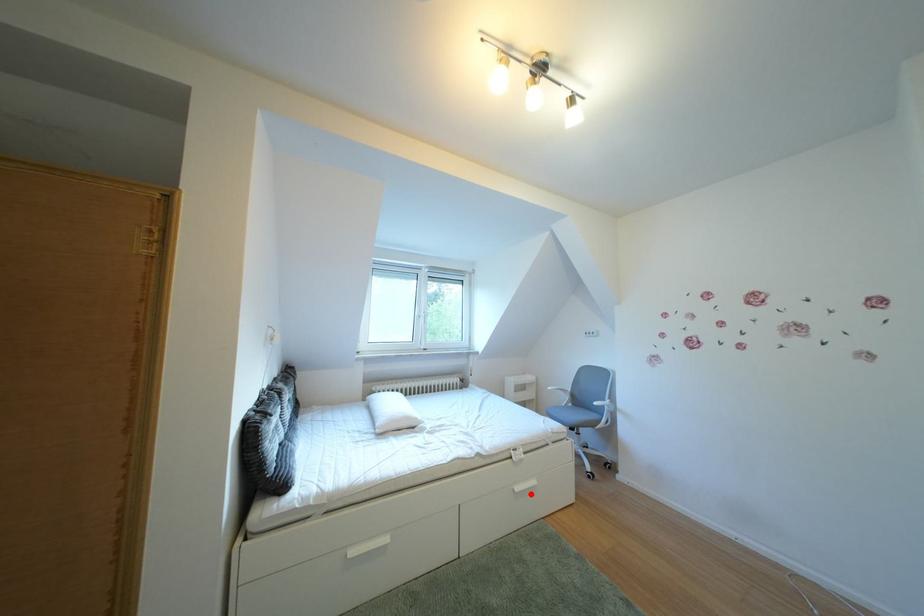
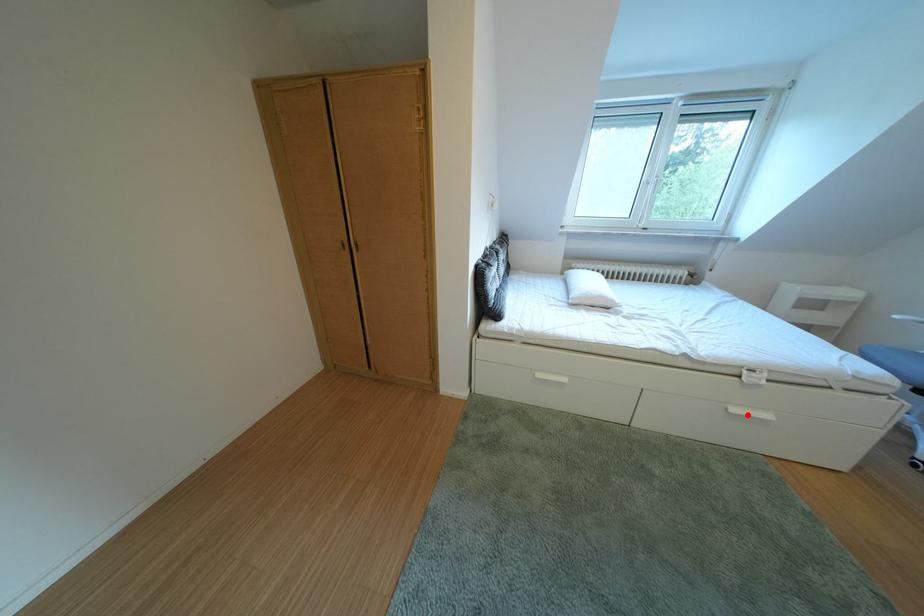
I am providing you with two images of the same scene from different viewpoints. A red point is marked on the first image and another point is marked on the second image. Is the red point in image1 aligned with the point shown in image2?

Yes